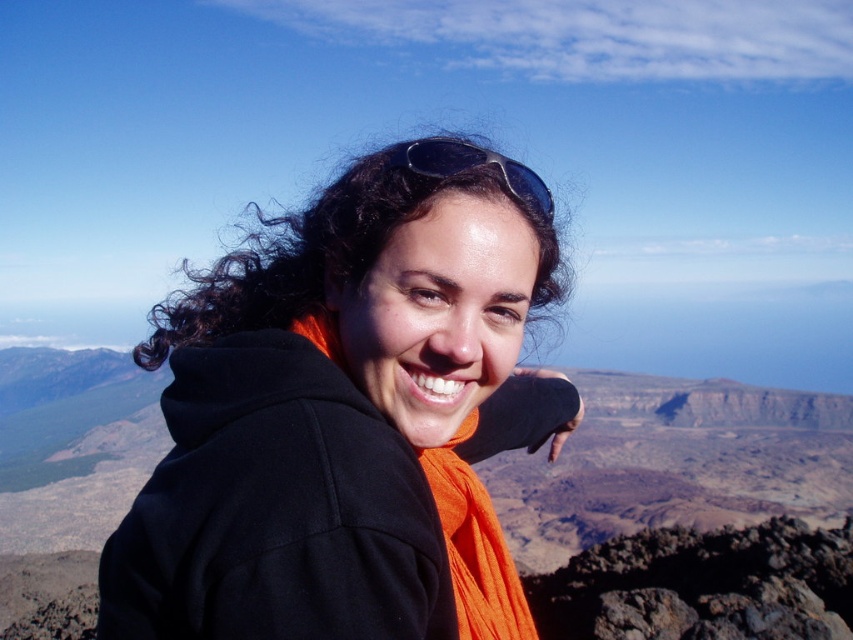
You are a photographer trying to capture the person in the image. You notice the black fleece jacket at center and the black plastic sunglasses at upper center. Which object should you focus on first to ensure both are in the frame?

The black fleece jacket at center is closer to the viewer than the black plastic sunglasses at upper center, so you should focus on the black fleece jacket at center first to ensure both are in the frame.

You are a photographer trying to capture the person in the image. You notice the black fleece jacket at center and the black plastic sunglasses at upper center. Which object should you focus on first if you want to ensure both are in the frame without moving the camera?

You should focus on the black fleece jacket at center first because it is much taller than the black plastic sunglasses at upper center, so it will occupy more space in the frame and require proper framing before adjusting for the smaller object.

You are a drone operator tasked with capturing aerial footage of the rugged terrain. You notice two points of interest marked as point (343, 504) and another point. Your drone has a maximum flight range of 15 meters. Can you fly from one point to the other without exceeding the drone range?

The two points are 12.92 meters apart, so yes, the drone can fly between them without exceeding its 15 meter range.